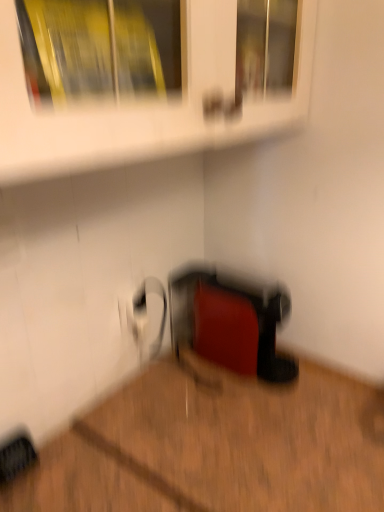
In order to click on vacant area in front of rubberized red toaster at lower center in this screenshot , I will do `click(267, 424)`.